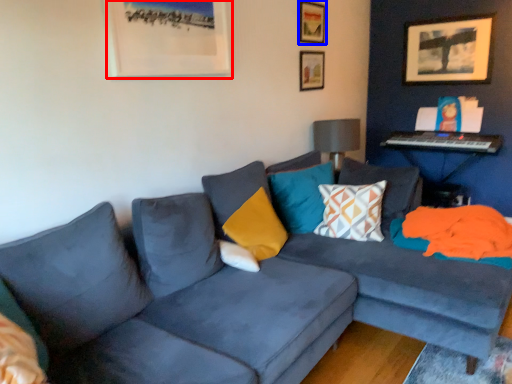
Question: Among these objects, which one is farthest to the camera, picture frame (highlighted by a red box) or picture frame (highlighted by a blue box)?

Choices:
 (A) picture frame
 (B) picture frame

Answer: (B)